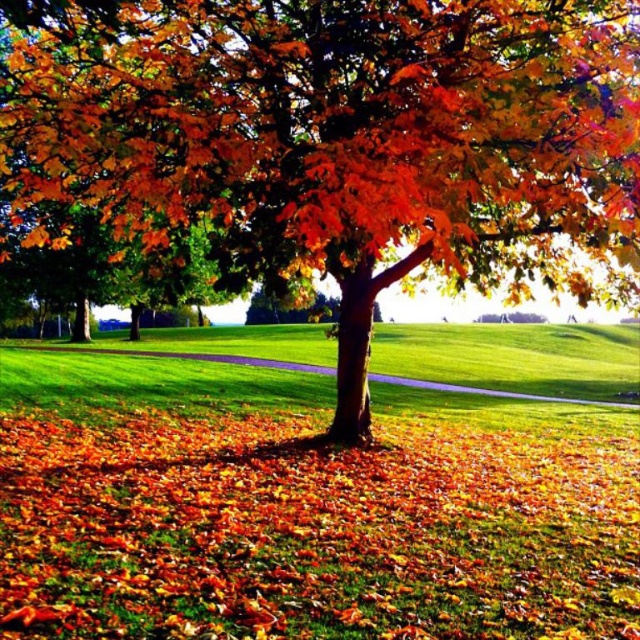
You are standing at the base of the large tree and want to walk towards the winding path behind it. Which direction should you face to avoid stepping on the shiny orange leaves at center and the green grass at center?

You should face towards the right side of the green grass at center since the shiny orange leaves at center is to the left of green grass at center, so moving to the right of the green grass at center will avoid both.

You are standing at the center of the image and want to pick up the shiny orange leaves at center. Which direction should you move to reach them?

The shiny orange leaves at center are already at the center of the image, so you don not need to move in any direction to reach them.

You are planning to place a small garden ornament that requires a space of 10 square inches. Looking at the shiny orange leaves at center and the green grass at center, which area can accommodate the ornament without overlapping?

The green grass at center is larger than the shiny orange leaves at center, so the ornament can be placed there without overlapping.